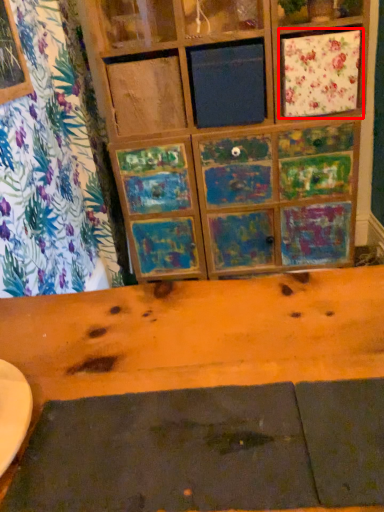
Question: From the image's perspective, where is cabinetry (annotated by the red box) located in relation to plank in the image?

Choices:
 (A) below
 (B) above

Answer: (B)